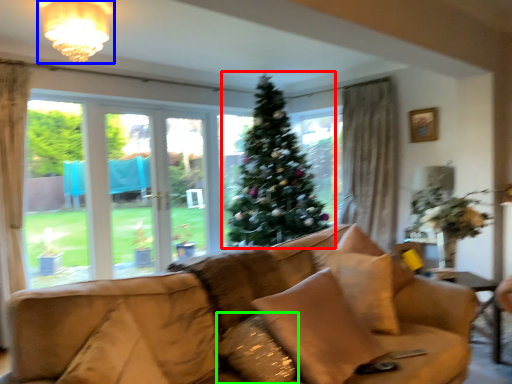
Question: Which object is the farthest from christmas tree (highlighted by a red box)? Choose among these: light fixture (highlighted by a blue box) or pillow (highlighted by a green box).

Choices:
 (A) light fixture
 (B) pillow

Answer: (B)